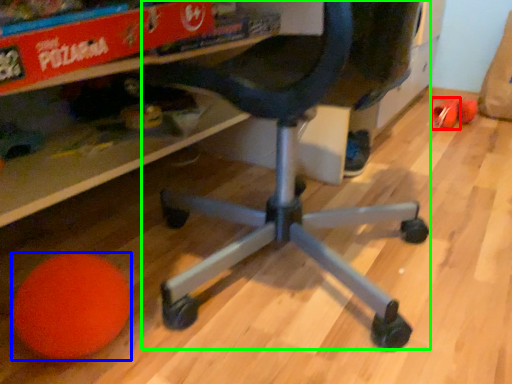
Question: Which is farther away from toy (highlighted by a red box)? ball (highlighted by a blue box) or computer chair (highlighted by a green box)?

Choices:
 (A) ball
 (B) computer chair

Answer: (A)